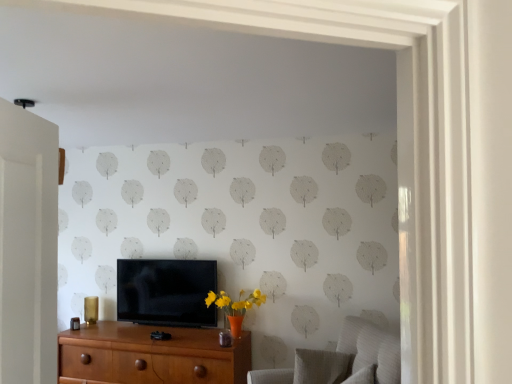
Question: Can you confirm if matte black tv at center is thinner than textured gray swivel chair at lower right, the first swivel chair viewed from the front?

Choices:
 (A) no
 (B) yes

Answer: (B)

Question: Is matte black tv at center next to textured gray swivel chair at lower right, marked as the second swivel chair in a back-to-front arrangement, and touching it?

Choices:
 (A) no
 (B) yes

Answer: (A)

Question: From a real-world perspective, is matte black tv at center located higher than textured gray swivel chair at lower right, marked as the second swivel chair in a back-to-front arrangement?

Choices:
 (A) no
 (B) yes

Answer: (B)

Question: Is matte black tv at center located outside textured gray swivel chair at lower right, marked as the second swivel chair in a back-to-front arrangement?

Choices:
 (A) no
 (B) yes

Answer: (B)

Question: Does matte black tv at center appear on the right side of textured gray swivel chair at lower right, the first swivel chair viewed from the front?

Choices:
 (A) yes
 (B) no

Answer: (B)

Question: From the image's perspective, is matte black tv at center on top of textured gray swivel chair at lower right, marked as the second swivel chair in a back-to-front arrangement?

Choices:
 (A) yes
 (B) no

Answer: (A)

Question: Is textured gray swivel chair at lower right, the 1th swivel chair when ordered from back to front, aimed at brown wood chest of drawers at lower center?

Choices:
 (A) no
 (B) yes

Answer: (A)

Question: Is textured gray swivel chair at lower right, which ranks as the 2th swivel chair in front-to-back order, wider than brown wood chest of drawers at lower center?

Choices:
 (A) yes
 (B) no

Answer: (B)

Question: From a real-world perspective, is textured gray swivel chair at lower right, which ranks as the 2th swivel chair in front-to-back order, under brown wood chest of drawers at lower center?

Choices:
 (A) yes
 (B) no

Answer: (B)

Question: Can you confirm if textured gray swivel chair at lower right, the 1th swivel chair when ordered from back to front, is thinner than brown wood chest of drawers at lower center?

Choices:
 (A) yes
 (B) no

Answer: (A)

Question: Is textured gray swivel chair at lower right, which ranks as the 2th swivel chair in front-to-back order, shorter than brown wood chest of drawers at lower center?

Choices:
 (A) yes
 (B) no

Answer: (A)

Question: Is textured gray swivel chair at lower right, which ranks as the 2th swivel chair in front-to-back order, at the right side of brown wood chest of drawers at lower center?

Choices:
 (A) no
 (B) yes

Answer: (B)

Question: Is textured gray swivel chair at lower right, marked as the second swivel chair in a back-to-front arrangement, taller than textured gray swivel chair at lower right, which ranks as the 2th swivel chair in front-to-back order?

Choices:
 (A) no
 (B) yes

Answer: (B)